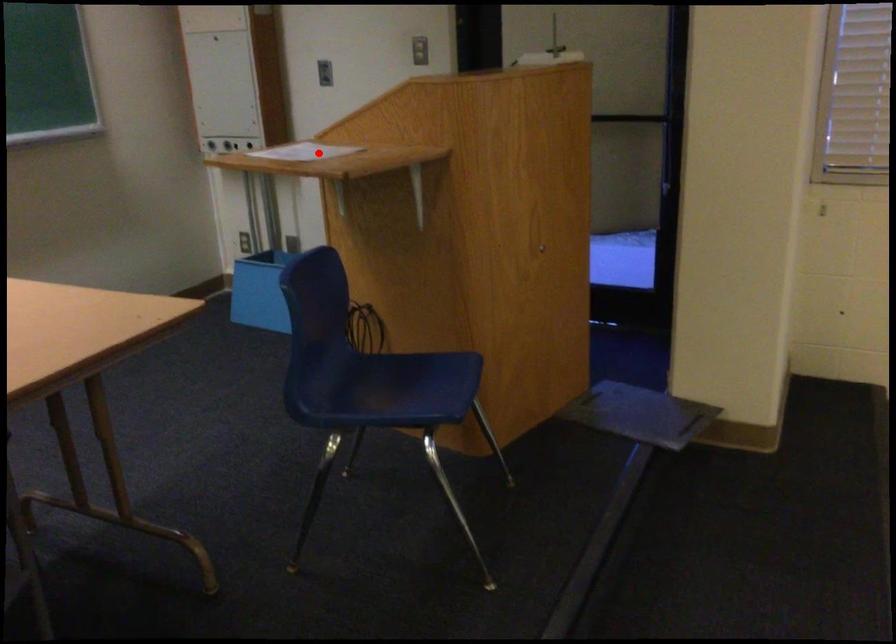
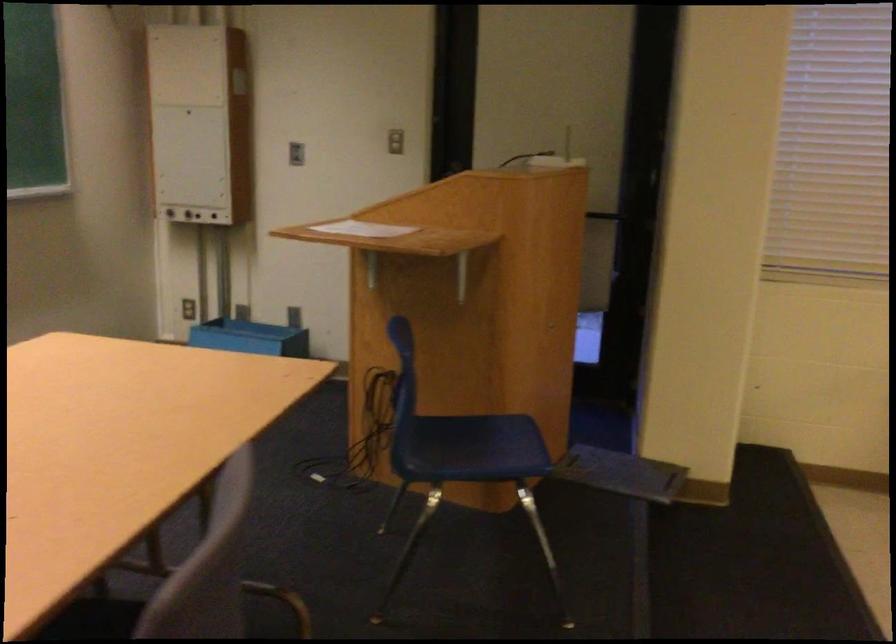
Question: A red point is marked in image1. In image2, is the corresponding 3D point closer to the camera or farther? Reply with the corresponding letter.

Choices:
 (A) The corresponding 3D point is closer.
 (B) The corresponding 3D point is farther.

Answer: (B)